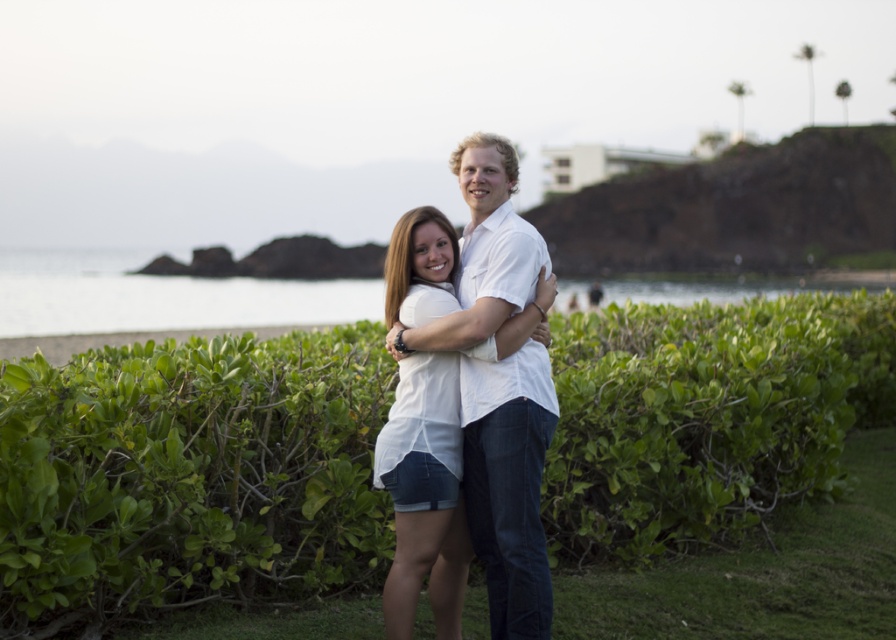
Based on the photo, you are a photographer adjusting your camera focus. You need to focus on both the point at (627, 394) and the point at (479, 150). Which point should you focus on first to ensure both are in focus?

You should focus on point (479, 150) first because it is closer to the camera than point (627, 394). By focusing on the closer point, the further point will also be within the depth of field.

Consider the image. You are a photographer trying to capture a photo of the couple without any obstructions. You notice the green leafy hedge at center and the white cotton shirt at center. Which object is wider, making it more likely to block the view?

The green leafy hedge at center might be wider than the white cotton shirt at center, so it could potentially block the view more than the white cotton shirt at center.